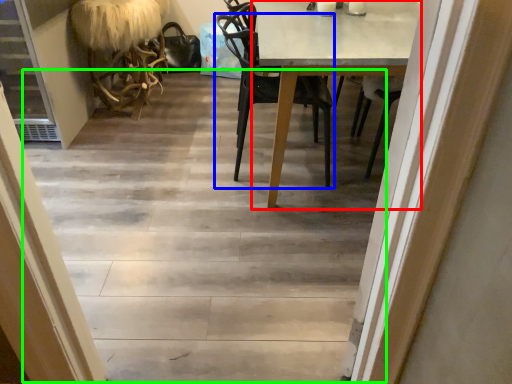
Question: Which is farther away from round table (highlighted by a red box)? chair (highlighted by a blue box) or stairwell (highlighted by a green box)?

Choices:
 (A) chair
 (B) stairwell

Answer: (B)